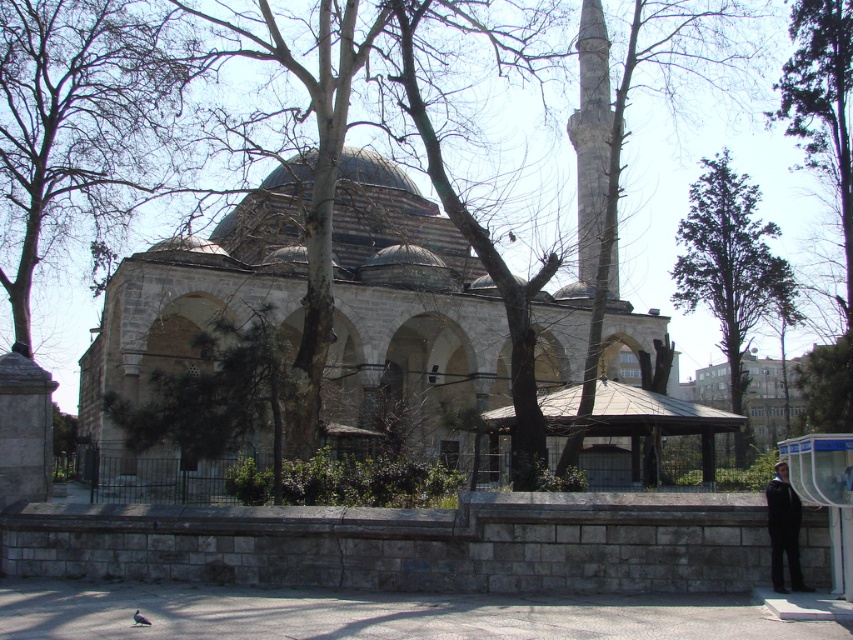
Question: Which point is farther from the camera taking this photo?

Choices:
 (A) (584, 125)
 (B) (578, 253)
 (C) (820, 451)

Answer: (A)

Question: Is brown wooden gazebo at lower right thinner than gray stone minaret at upper right?

Choices:
 (A) yes
 (B) no

Answer: (B)

Question: Which point is farther from the camera taking this photo?

Choices:
 (A) (718, 204)
 (B) (825, 148)
 (C) (787, 477)
 (D) (634, 397)

Answer: (A)

Question: From the image, what is the correct spatial relationship of green coniferous tree at upper right in relation to gray stone minaret at upper right?

Choices:
 (A) right
 (B) left

Answer: (A)

Question: Which object is the closest to the transparent plastic bus stop at lower right?

Choices:
 (A) dark blue fabric jacket at lower right
 (B) brown wooden gazebo at lower right
 (C) green leafy tree at right
 (D) green coniferous tree at upper right

Answer: (A)

Question: Does gray stone minaret at center appear on the left side of dark blue fabric jacket at lower right?

Choices:
 (A) yes
 (B) no

Answer: (B)